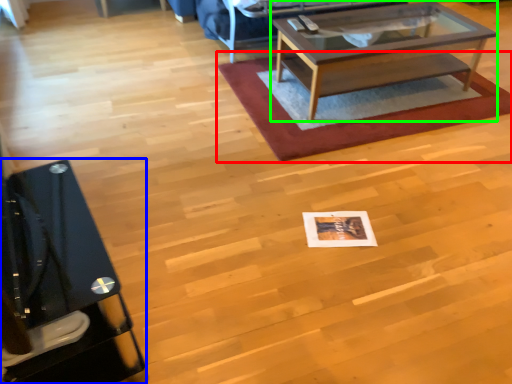
Question: Considering the real-world distances, which object is farthest from mat (highlighted by a red box)? desk (highlighted by a blue box) or coffee table (highlighted by a green box)?

Choices:
 (A) desk
 (B) coffee table

Answer: (A)